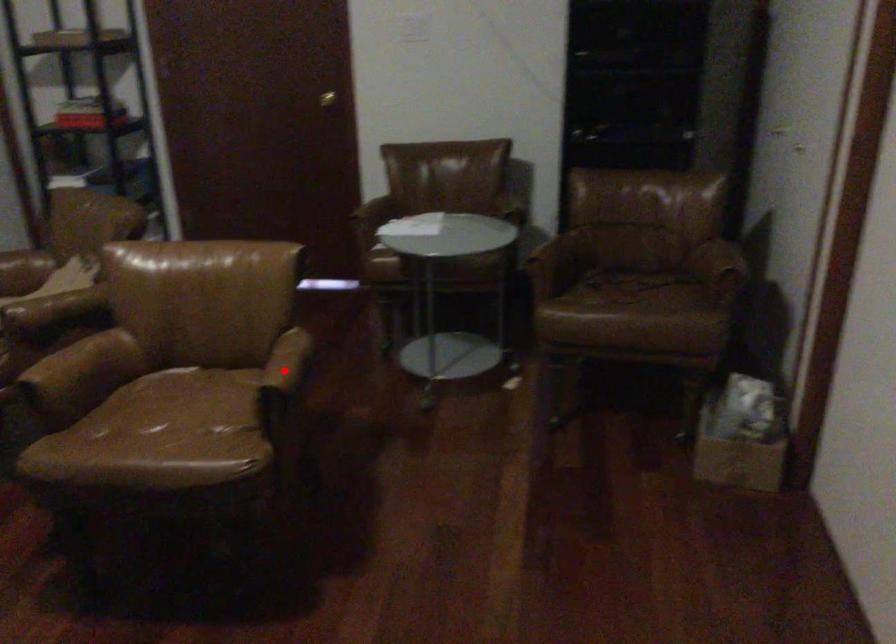
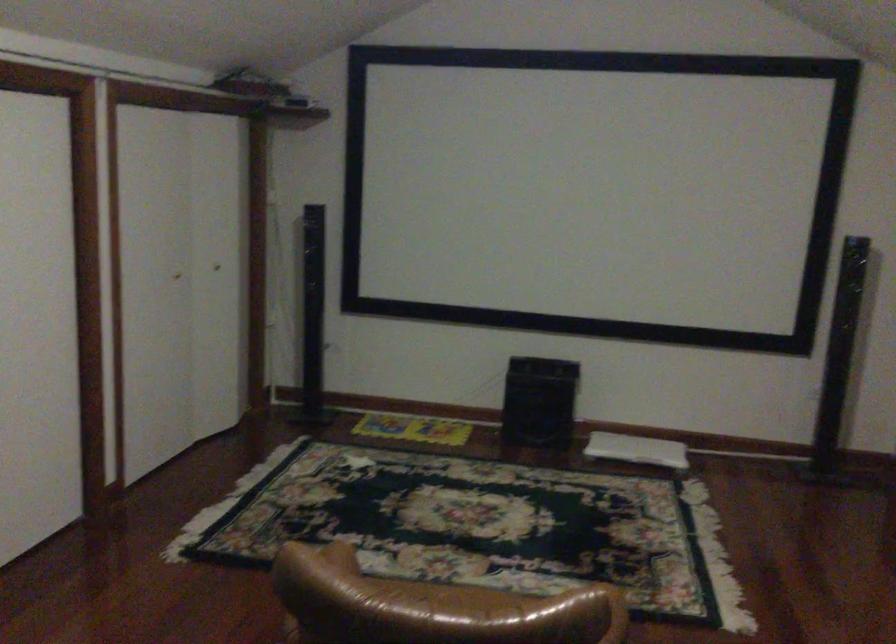
Question: I am providing you with two images of the same scene from different viewpoints. A red point is marked on the first image. Is the red point's position out of view in image 2?

Choices:
 (A) Yes
 (B) No

Answer: (A)